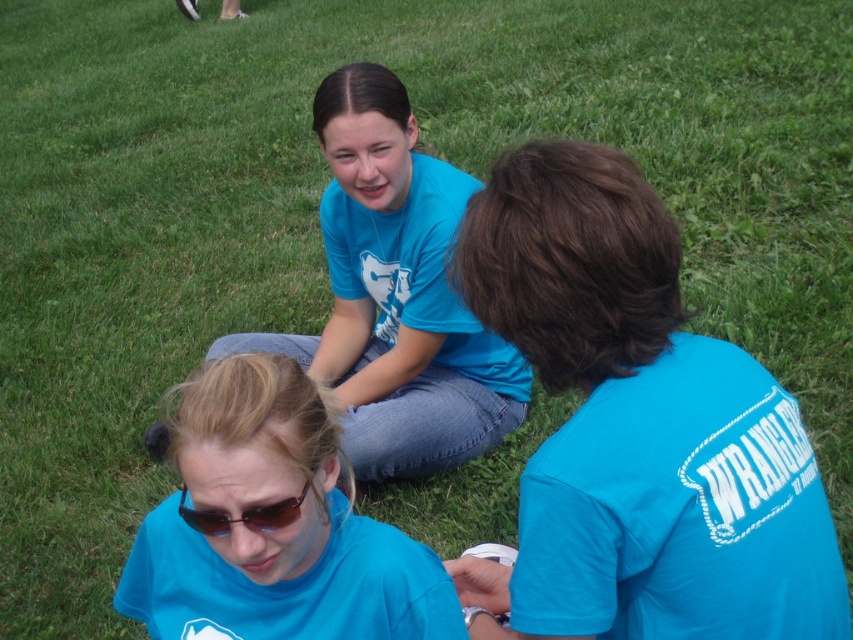
You are standing at the camera position and want to take a photo of the point at coordinates point (781, 570). Is the point within your reach to focus on with your camera?

The point (781, 570) is 4.03 feet away from camera, so yes, it is within the camera focus range since it is close enough.

You are standing at the point with coordinates point [465,426] and want to walk to the point with coordinates point [326,586]. Which direction should you move?

You should move forward since point [326,586] is in front of point [465,426].

In the scene shown: Please check the coordinates provided. Is the point at (x=636, y=429) located on the matte blue shirt at center?

Yes, the point at (x=636, y=429) is located on the matte blue shirt at center according to the coordinates provided.